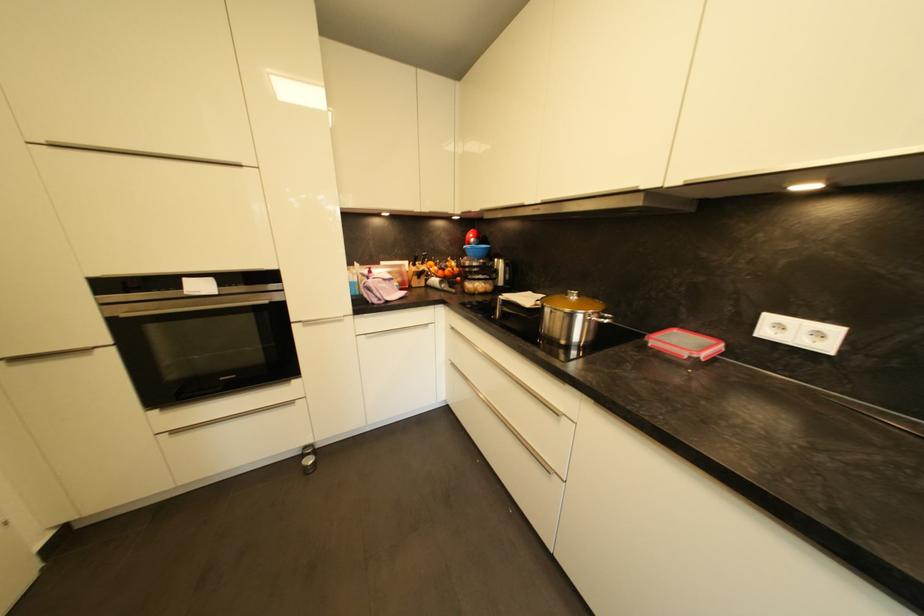
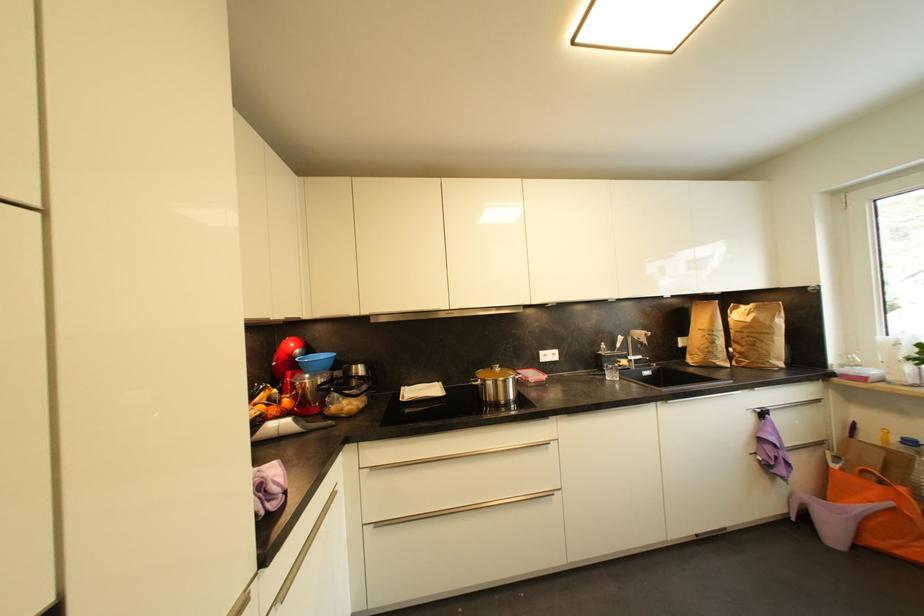
In the second image, find the point that corresponds to the point at 445,274 in the first image.

(277, 411)